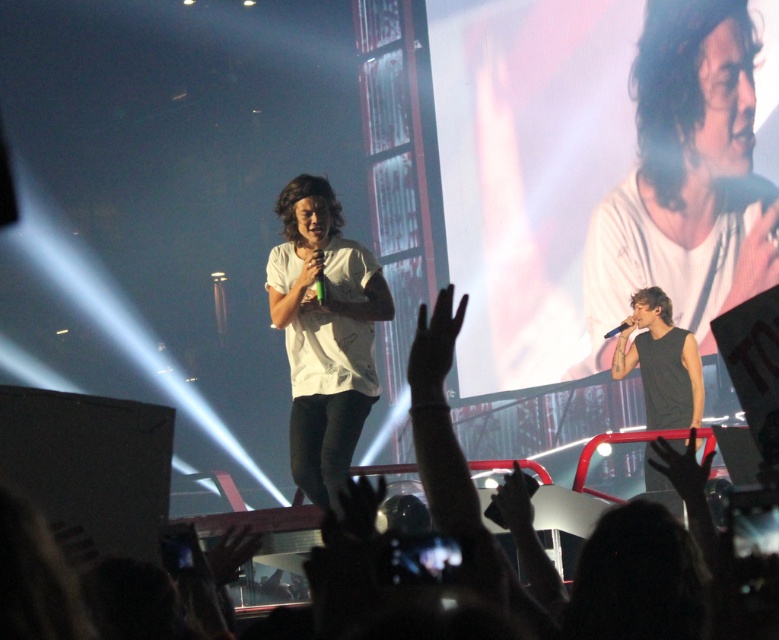
You are at the concert and want to take a photo of both performers. The first performer is at point (360, 364) and the second performer is at point (319, 253). Which performer should you focus on first to ensure both are in the frame?

You should focus on the second performer at point (319, 253) first because point (360, 364) is behind it. This way, adjusting the camera angle to include both will be easier since the closer performer is in front.

You are a photographer at the concert. You want to take a photo of the white matte shirt at upper right and the black plastic microphone at upper right. However, the microphone is blocking part of the shirt. Can you adjust your position to capture both items fully in the frame without any obstruction?

The black plastic microphone at upper right is behind the white matte shirt at upper right, so moving your camera position slightly forward or to the side might allow you to capture both items without obstruction.